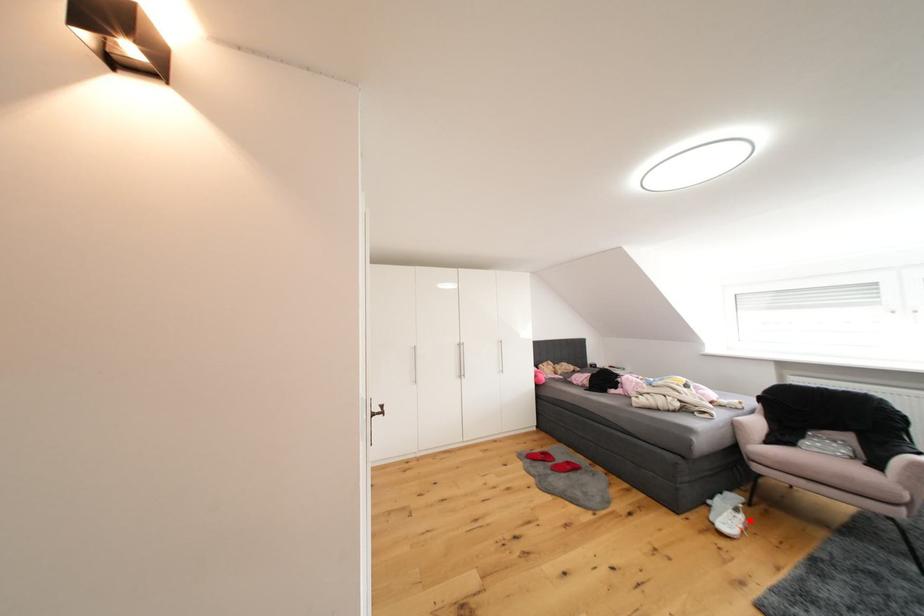
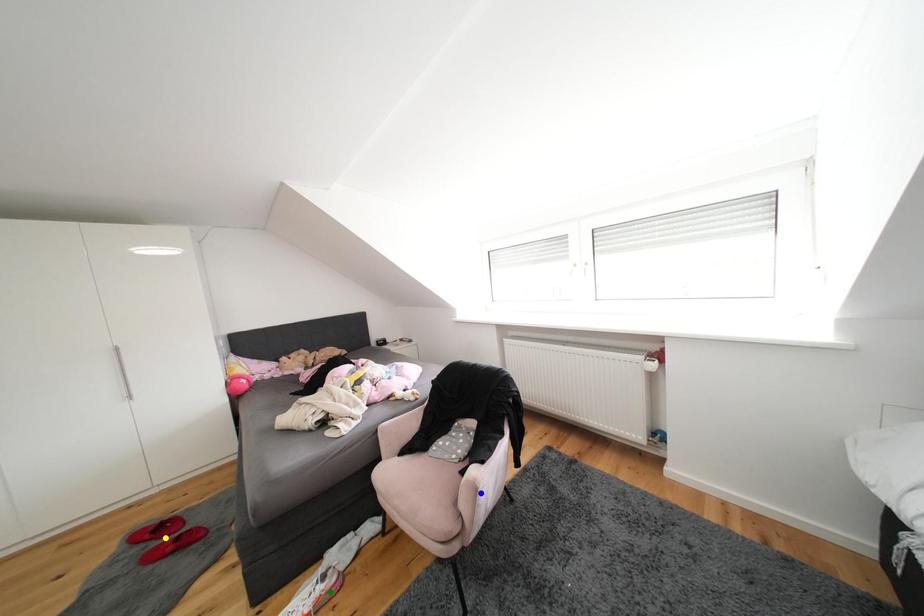
Question: I am providing you with two images of the same scene from different viewpoints. A red point is marked on the first image. You are given multiple points on the second image. Which point in image 2 is actually the same real-world point as the red point in image 1?

Choices:
 (A) blue point
 (B) green point
 (C) yellow point

Answer: (B)